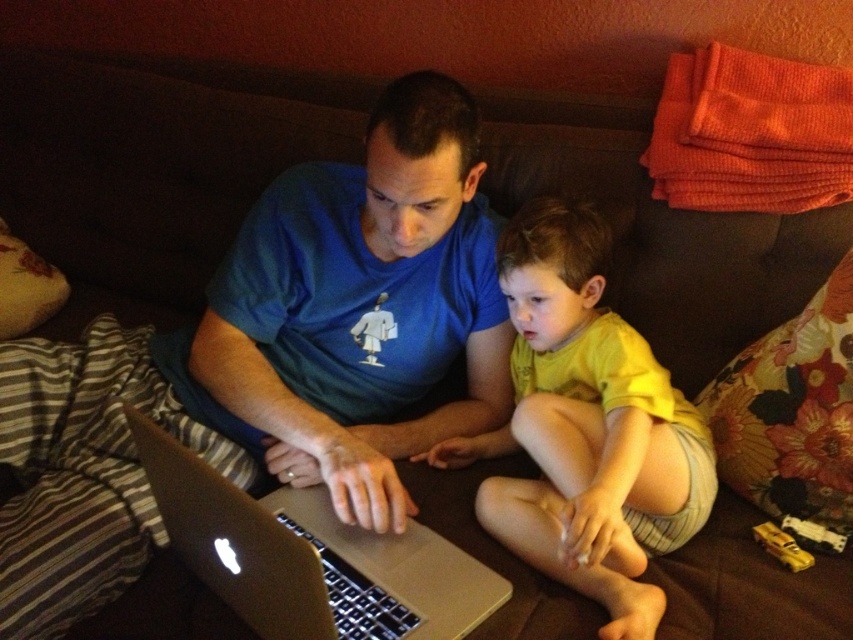
From the picture: Between yellow cotton shirt at center and silver metallic laptop at center, which one is positioned lower?

silver metallic laptop at center

The image size is (853, 640). What are the coordinates of `yellow cotton shirt at center` in the screenshot? It's located at (585, 428).

What are the coordinates of `yellow cotton shirt at center` in the screenshot? It's located at (585, 428).